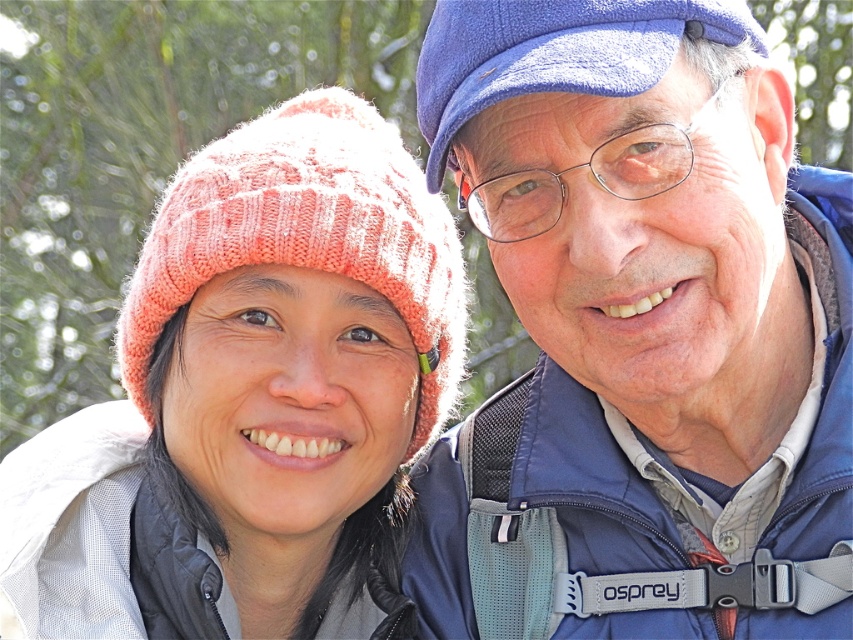
Question: Is the position of blue fabric jacket at upper right more distant than that of blue fabric cap at upper right?

Choices:
 (A) yes
 (B) no

Answer: (A)

Question: Considering the real-world distances, which object is farthest from the pink knitted beanie at upper left?

Choices:
 (A) blue fabric jacket at upper right
 (B) blue fabric cap at upper right

Answer: (B)

Question: Which object is positioned farthest from the blue fabric jacket at upper right?

Choices:
 (A) pink knitted beanie at upper left
 (B) blue fabric cap at upper right

Answer: (A)

Question: Is pink knitted beanie at upper left thinner than blue fabric cap at upper right?

Choices:
 (A) no
 (B) yes

Answer: (A)

Question: In this image, where is pink knitted beanie at upper left located relative to blue fabric cap at upper right?

Choices:
 (A) below
 (B) above

Answer: (A)

Question: Estimate the real-world distances between objects in this image. Which object is farther from the blue fabric cap at upper right?

Choices:
 (A) pink knitted beanie at upper left
 (B) blue fabric jacket at upper right

Answer: (A)